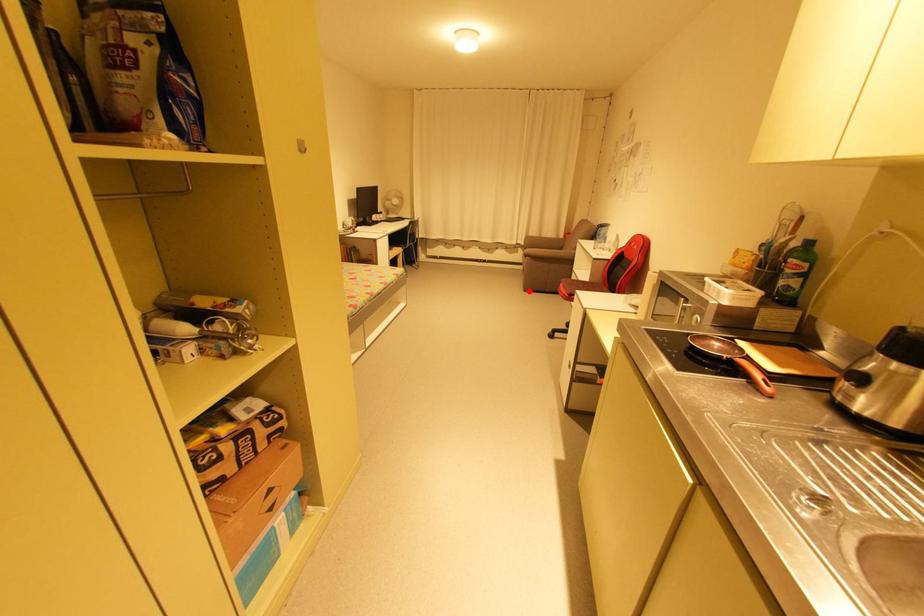
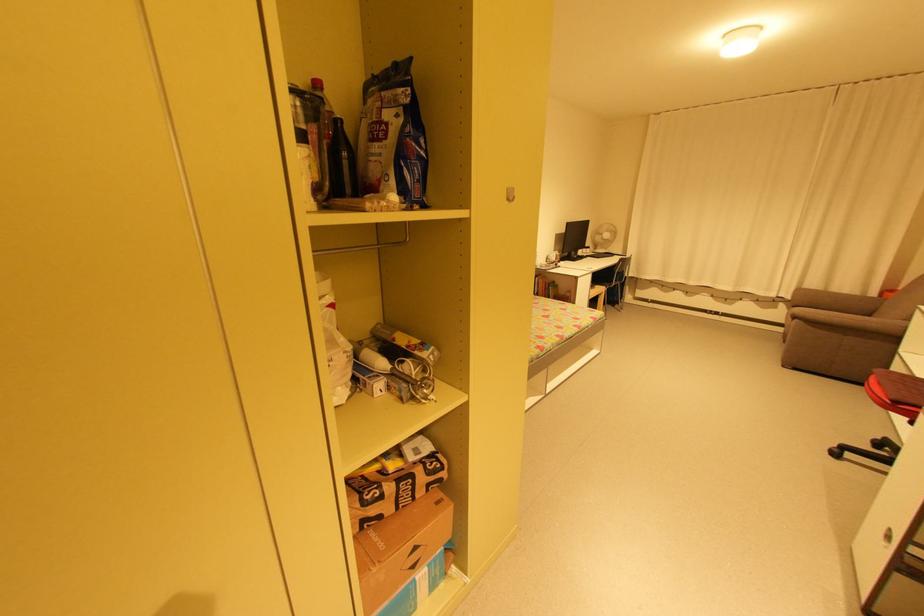
Where in the second image is the point corresponding to the highlighted location from the first image?

(788, 367)